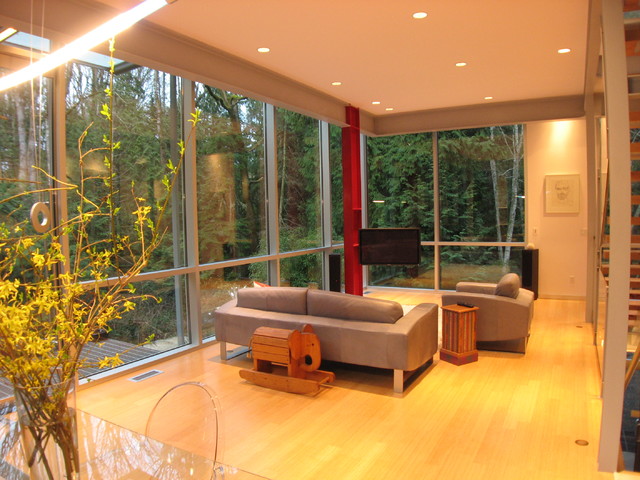
Where is `two seater couch`? two seater couch is located at coordinates (358, 338).